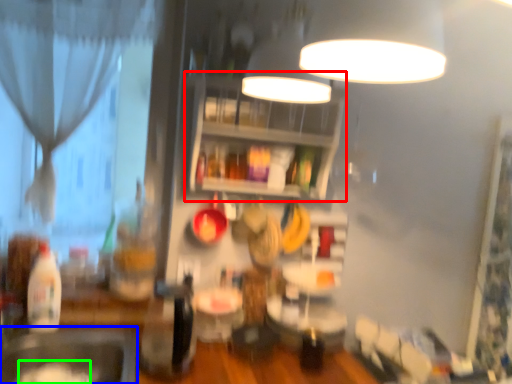
Question: Which object is the farthest from shelf (highlighted by a red box)? Choose among these: sink (highlighted by a blue box) or food (highlighted by a green box).

Choices:
 (A) sink
 (B) food

Answer: (B)